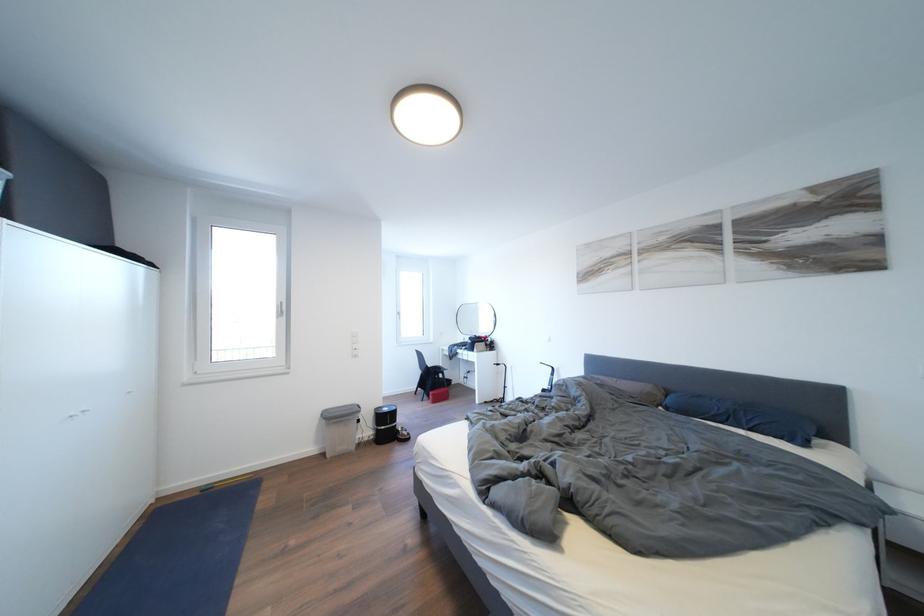
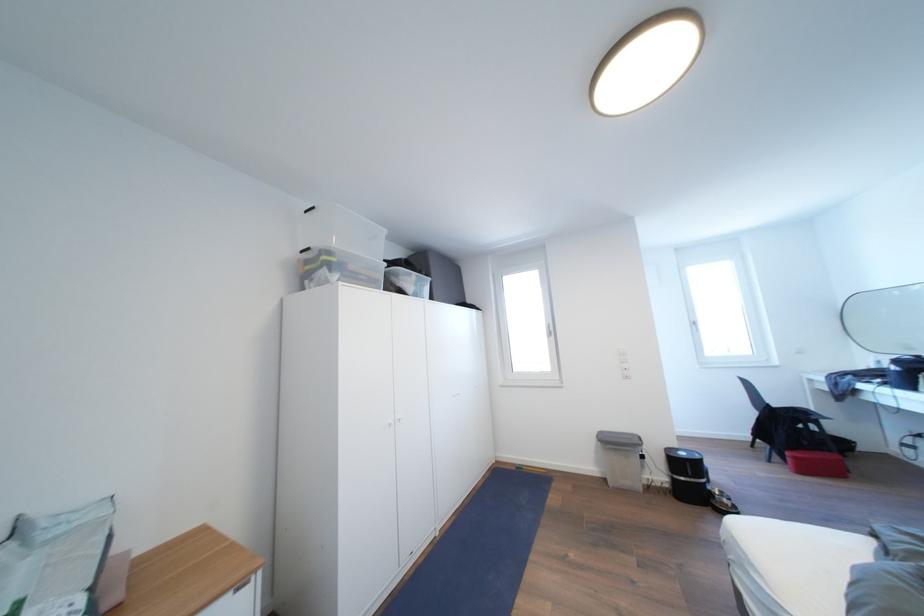
Find the pixel in the second image that matches pixel 441 400 in the first image.

(803, 463)